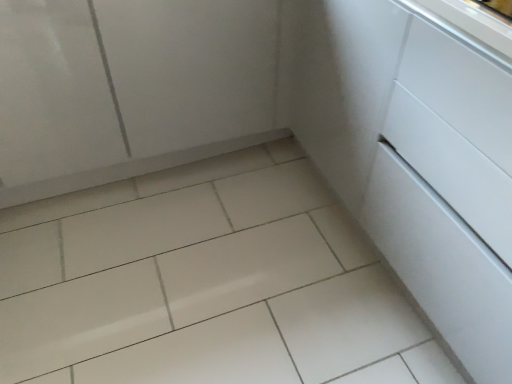
Question: Considering the positions of white glossy tile at center and white glossy cabinet at upper left in the image, is white glossy tile at center taller or shorter than white glossy cabinet at upper left?

Choices:
 (A) tall
 (B) short

Answer: (B)

Question: From the image's perspective, relative to white glossy cabinet at upper left, is white glossy tile at center above or below?

Choices:
 (A) below
 (B) above

Answer: (A)

Question: Which object is the closest to the white glossy tile at center?

Choices:
 (A) white glossy cabinet at upper left
 (B) white glossy drawer at center-right

Answer: (A)

Question: Based on their relative distances, which object is farther from the white glossy drawer at center-right?

Choices:
 (A) white glossy cabinet at upper left
 (B) white glossy tile at center

Answer: (A)